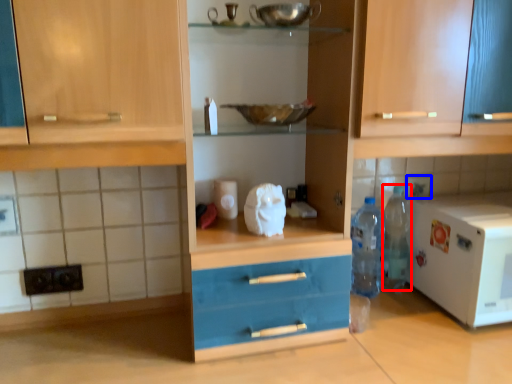
Question: Which of the following is the farthest to the observer, bottle (highlighted by a red box) or tile (highlighted by a blue box)?

Choices:
 (A) bottle
 (B) tile

Answer: (B)